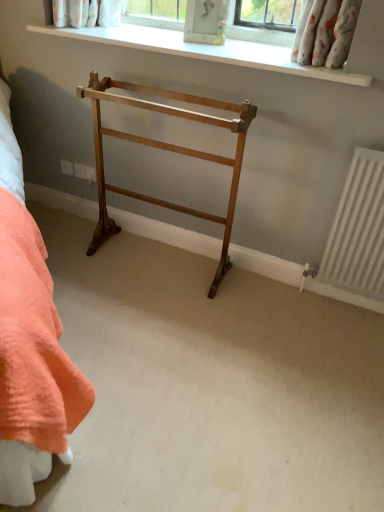
Question: Considering the positions of point (99, 202) and point (304, 73), is point (99, 202) closer or farther from the camera than point (304, 73)?

Choices:
 (A) closer
 (B) farther

Answer: (B)

Question: In terms of width, does light brown wood towel rack at center look wider or thinner when compared to white smooth window sill at upper center?

Choices:
 (A) thin
 (B) wide

Answer: (A)

Question: Relative to white smooth window sill at upper center, is light brown wood towel rack at center in front or behind?

Choices:
 (A) behind
 (B) front

Answer: (B)

Question: From the image's perspective, is white smooth window sill at upper center located above or below light brown wood towel rack at center?

Choices:
 (A) below
 (B) above

Answer: (B)

Question: Is white smooth window sill at upper center in front of or behind light brown wood towel rack at center in the image?

Choices:
 (A) behind
 (B) front

Answer: (A)

Question: Is white smooth window sill at upper center taller or shorter than light brown wood towel rack at center?

Choices:
 (A) short
 (B) tall

Answer: (A)

Question: Does point (283, 61) appear closer or farther from the camera than point (238, 105)?

Choices:
 (A) farther
 (B) closer

Answer: (B)